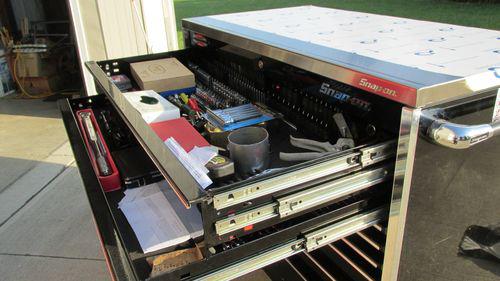
The width and height of the screenshot is (500, 281). Identify the location of handle. (459, 132).